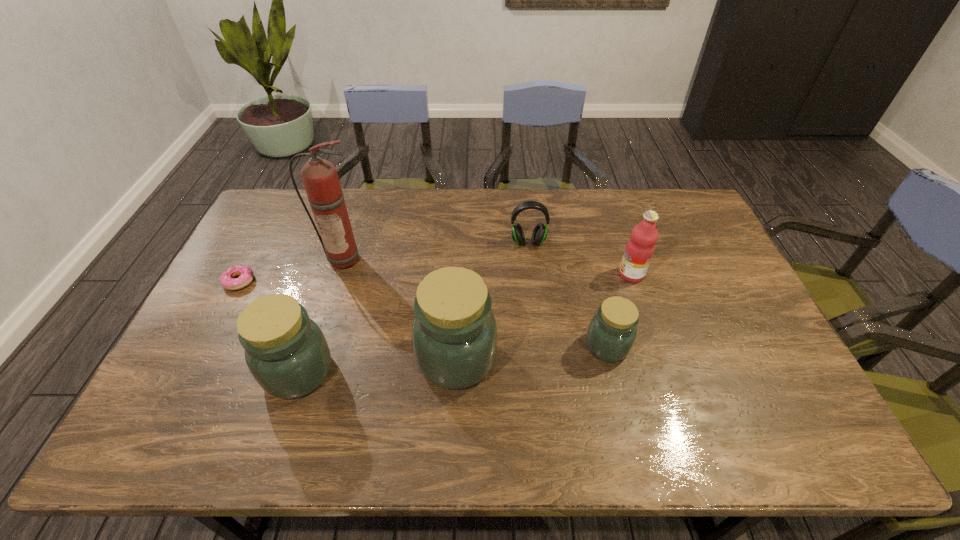
This screenshot has width=960, height=540. I want to click on the second shortest jar, so click(286, 352).

At what (x,y) coordinates should I click in order to perform the action: click on the second jar from right to left. Please return your answer as a coordinate pair (x, y). The image size is (960, 540). Looking at the image, I should click on (454, 333).

Where is `the second object from right to left`? The width and height of the screenshot is (960, 540). the second object from right to left is located at coordinates (611, 334).

In order to click on the shortest jar in this screenshot , I will do pyautogui.click(x=611, y=334).

The height and width of the screenshot is (540, 960). Find the location of `the tallest object`. the tallest object is located at coordinates (319, 176).

You are a GUI agent. You are given a task and a screenshot of the screen. Output one action in this format:
    pyautogui.click(x=<x>, y=<y>)
    Task: Click on the fifth object from left to right
    This screenshot has height=540, width=960.
    Given the screenshot: What is the action you would take?
    pyautogui.click(x=539, y=234)

Identify the location of the leftmost object. (245, 273).

Locate an element on the screen. Image resolution: width=960 pixels, height=540 pixels. doughnut is located at coordinates (245, 273).

This screenshot has width=960, height=540. Identify the location of the rightmost object. (639, 250).

Find the location of a particular element. The height and width of the screenshot is (540, 960). vacant space located 0.050m on the right of the leftmost jar is located at coordinates (353, 372).